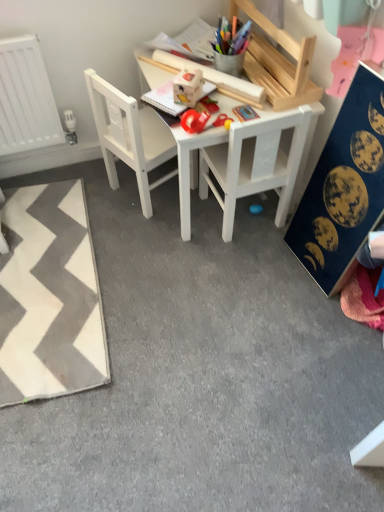
At what (x,y) coordinates should I click in order to perform the action: click on vacant point to the right of white zigzag rug at lower left. Please return your answer as a coordinate pair (x, y). This screenshot has height=512, width=384. Looking at the image, I should click on (194, 313).